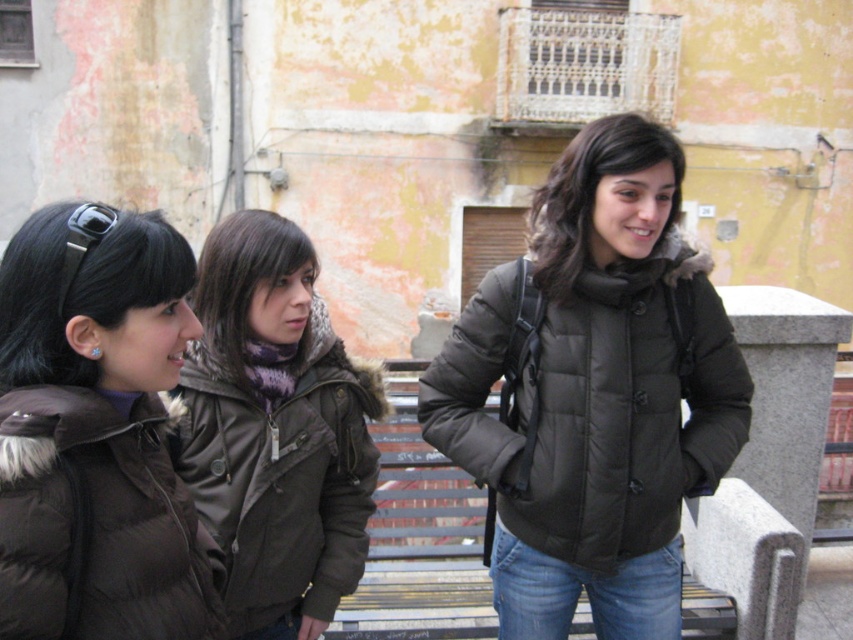
Question: Can you confirm if black puffy jacket at center is positioned to the right of black down jacket at left?

Choices:
 (A) yes
 (B) no

Answer: (A)

Question: Which of the following is the closest to the observer?

Choices:
 (A) matte black hair at left
 (B) black down jacket at left
 (C) black puffy jacket at center
 (D) matte brown jacket at center

Answer: (B)

Question: Considering the relative positions of black puffy jacket at center and black down jacket at left in the image provided, where is black puffy jacket at center located with respect to black down jacket at left?

Choices:
 (A) above
 (B) below

Answer: (A)

Question: Which point appears farthest from the camera in this image?

Choices:
 (A) (360, 419)
 (B) (33, 540)

Answer: (A)

Question: Which object is farther from the camera taking this photo?

Choices:
 (A) matte brown jacket at center
 (B) black puffy jacket at center
 (C) black down jacket at left
 (D) matte black hair at left

Answer: (B)

Question: Where is black puffy jacket at center located in relation to black down jacket at left in the image?

Choices:
 (A) right
 (B) left

Answer: (A)